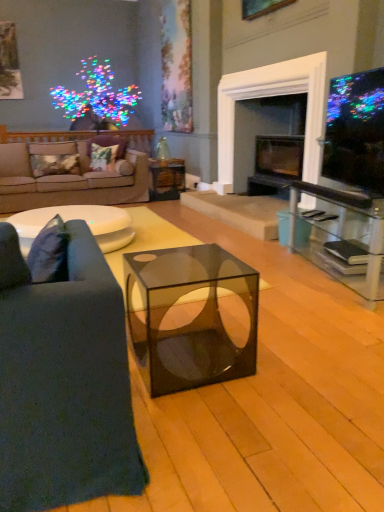
Find the location of a particular element. free space to the left of clear glass entertainment center at right is located at coordinates (273, 282).